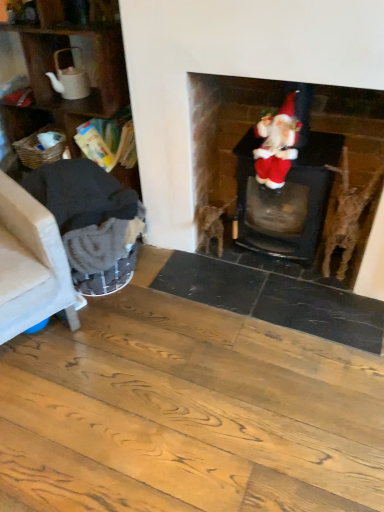
This screenshot has height=512, width=384. I want to click on wooden textured shelf at left, so click(84, 79).

Where is `dark gray fabric armchair at left, which is the first armchair from right to left`? dark gray fabric armchair at left, which is the first armchair from right to left is located at coordinates (89, 221).

The height and width of the screenshot is (512, 384). What do you see at coordinates (89, 221) in the screenshot? I see `dark gray fabric armchair at left, marked as the second armchair in a left-to-right arrangement` at bounding box center [89, 221].

In the scene shown: In order to face beige fabric armchair at left, acting as the first armchair starting from the left, should I rotate leftwards or rightwards?

It's best to rotate left around 26.788 degrees.

Where is `velvet santa at upper right`? The width and height of the screenshot is (384, 512). velvet santa at upper right is located at coordinates (224, 127).

Image resolution: width=384 pixels, height=512 pixels. Find the location of `wooden textured shelf at left`. wooden textured shelf at left is located at coordinates (84, 79).

Which is correct: velvet santa at center is inside wooden textured shelf at left, or outside of it?

velvet santa at center cannot be found inside wooden textured shelf at left.

Considering the relative positions of velvet santa at center and wooden textured shelf at left in the image provided, is velvet santa at center behind wooden textured shelf at left?

No, velvet santa at center is closer to the camera.

From the image's perspective, which one is positioned lower, velvet santa at center or wooden textured shelf at left?

velvet santa at center is shown below in the image.

Between velvet santa at center and wooden textured shelf at left, which one has less height?

Standing shorter between the two is velvet santa at center.

Is wooden textured shelf at left positioned far away from velvet santa at upper right?

wooden textured shelf at left is actually quite close to velvet santa at upper right.

From the image's perspective, which is above, wooden textured shelf at left or velvet santa at upper right?

wooden textured shelf at left is shown above in the image.

Does wooden textured shelf at left have a smaller size compared to velvet santa at upper right?

No.

Is point (60, 36) less distant than point (355, 173)?

Yes, it is in front of point (355, 173).

Is velvet santa at upper right not inside beige fabric armchair at left, acting as the first armchair starting from the left?

Yes, velvet santa at upper right is located beyond the bounds of beige fabric armchair at left, acting as the first armchair starting from the left.

From the image's perspective, relative to beige fabric armchair at left, placed as the 2th armchair when sorted from right to left, is velvet santa at upper right above or below?

Clearly, from the image's perspective, velvet santa at upper right is above beige fabric armchair at left, placed as the 2th armchair when sorted from right to left.

From a real-world perspective, does velvet santa at upper right sit lower than beige fabric armchair at left, placed as the 2th armchair when sorted from right to left?

No, from a real-world perspective, velvet santa at upper right is not under beige fabric armchair at left, placed as the 2th armchair when sorted from right to left.

Between velvet santa at upper right and beige fabric armchair at left, acting as the first armchair starting from the left, which one has smaller width?

velvet santa at upper right is thinner.

Based on the photo, is dark gray fabric armchair at left, marked as the second armchair in a left-to-right arrangement, a part of wooden textured shelf at left?

No, dark gray fabric armchair at left, marked as the second armchair in a left-to-right arrangement, is not surrounded by wooden textured shelf at left.

How many degrees apart are the facing directions of wooden textured shelf at left and dark gray fabric armchair at left, marked as the second armchair in a left-to-right arrangement?

71.5 degrees.

This screenshot has width=384, height=512. What are the coordinates of `armchair on the right of wooden textured shelf at left` in the screenshot? It's located at (89, 221).

From a real-world perspective, relative to dark gray fabric armchair at left, which is the first armchair from right to left, is wooden textured shelf at left vertically above or below?

In terms of real-world spatial position, wooden textured shelf at left is above dark gray fabric armchair at left, which is the first armchair from right to left.

Does dark gray fabric armchair at left, marked as the second armchair in a left-to-right arrangement, appear on the right side of velvet santa at center?

No, dark gray fabric armchair at left, marked as the second armchair in a left-to-right arrangement, is not to the right of velvet santa at center.

Considering the points (87, 183) and (274, 161), which point is in front, point (87, 183) or point (274, 161)?

Point (274, 161)

Consider the image. Is dark gray fabric armchair at left, marked as the second armchair in a left-to-right arrangement, oriented towards velvet santa at center?

No, dark gray fabric armchair at left, marked as the second armchair in a left-to-right arrangement, does not turn towards velvet santa at center.

Is dark gray fabric armchair at left, which is the first armchair from right to left, not inside velvet santa at center?

Yes, dark gray fabric armchair at left, which is the first armchair from right to left, is not within velvet santa at center.

Between wooden textured shelf at left and beige fabric armchair at left, placed as the 2th armchair when sorted from right to left, which one has smaller width?

wooden textured shelf at left.

Is wooden textured shelf at left looking in the opposite direction of beige fabric armchair at left, acting as the first armchair starting from the left?

wooden textured shelf at left does not have its back to beige fabric armchair at left, acting as the first armchair starting from the left.

Which is more to the right, wooden textured shelf at left or beige fabric armchair at left, acting as the first armchair starting from the left?

Positioned to the right is wooden textured shelf at left.

Are wooden textured shelf at left and beige fabric armchair at left, placed as the 2th armchair when sorted from right to left, located far from each other?

They are positioned close to each other.

Would you say beige fabric armchair at left, acting as the first armchair starting from the left, is a long distance from dark gray fabric armchair at left, marked as the second armchair in a left-to-right arrangement?

No, there isn't a large distance between beige fabric armchair at left, acting as the first armchair starting from the left, and dark gray fabric armchair at left, marked as the second armchair in a left-to-right arrangement.

In the image, is beige fabric armchair at left, acting as the first armchair starting from the left, on the left side or the right side of dark gray fabric armchair at left, which is the first armchair from right to left?

From the image, it's evident that beige fabric armchair at left, acting as the first armchair starting from the left, is to the left of dark gray fabric armchair at left, which is the first armchair from right to left.

Could you measure the distance between beige fabric armchair at left, acting as the first armchair starting from the left, and dark gray fabric armchair at left, marked as the second armchair in a left-to-right arrangement?

beige fabric armchair at left, acting as the first armchair starting from the left, and dark gray fabric armchair at left, marked as the second armchair in a left-to-right arrangement, are 7.65 inches apart.

Is beige fabric armchair at left, acting as the first armchair starting from the left, inside or outside of dark gray fabric armchair at left, which is the first armchair from right to left?

beige fabric armchair at left, acting as the first armchair starting from the left, lies outside dark gray fabric armchair at left, which is the first armchair from right to left.

The height and width of the screenshot is (512, 384). What are the coordinates of `shelf behind the velvet santa at center` in the screenshot? It's located at (84, 79).

Where is `shelf above the velvet santa at upper right (from the image's perspective)`? The image size is (384, 512). shelf above the velvet santa at upper right (from the image's perspective) is located at coordinates (84, 79).

From the image, which object appears to be farther from dark gray fabric armchair at left, marked as the second armchair in a left-to-right arrangement, beige fabric armchair at left, acting as the first armchair starting from the left, or wooden textured shelf at left?

wooden textured shelf at left.

Based on their spatial positions, is beige fabric armchair at left, acting as the first armchair starting from the left, or wooden textured shelf at left further from velvet santa at upper right?

beige fabric armchair at left, acting as the first armchair starting from the left, is further to velvet santa at upper right.

Based on their spatial positions, is dark gray fabric armchair at left, marked as the second armchair in a left-to-right arrangement, or velvet santa at upper right further from beige fabric armchair at left, placed as the 2th armchair when sorted from right to left?

velvet santa at upper right lies further to beige fabric armchair at left, placed as the 2th armchair when sorted from right to left, than the other object.

From the image, which object appears to be nearer to velvet santa at upper right, velvet santa at center or beige fabric armchair at left, placed as the 2th armchair when sorted from right to left?

velvet santa at center is positioned closer to the anchor velvet santa at upper right.

From the image, which object appears to be farther from velvet santa at center, velvet santa at upper right or dark gray fabric armchair at left, marked as the second armchair in a left-to-right arrangement?

Based on the image, dark gray fabric armchair at left, marked as the second armchair in a left-to-right arrangement, appears to be further to velvet santa at center.

Considering their positions, is beige fabric armchair at left, placed as the 2th armchair when sorted from right to left, positioned closer to velvet santa at upper right than dark gray fabric armchair at left, marked as the second armchair in a left-to-right arrangement?

dark gray fabric armchair at left, marked as the second armchair in a left-to-right arrangement, lies closer to velvet santa at upper right than the other object.

From the image, which object appears to be nearer to velvet santa at center, velvet santa at upper right or wooden textured shelf at left?

The object closer to velvet santa at center is velvet santa at upper right.

When comparing their distances from velvet santa at upper right, does velvet santa at center or dark gray fabric armchair at left, which is the first armchair from right to left, seem further?

dark gray fabric armchair at left, which is the first armchair from right to left, lies further to velvet santa at upper right than the other object.

Where is `person located between beige fabric armchair at left, placed as the 2th armchair when sorted from right to left, and velvet santa at upper right in the left-right direction`? Image resolution: width=384 pixels, height=512 pixels. person located between beige fabric armchair at left, placed as the 2th armchair when sorted from right to left, and velvet santa at upper right in the left-right direction is located at coordinates (277, 144).

Where is `armchair between beige fabric armchair at left, placed as the 2th armchair when sorted from right to left, and velvet santa at center from left to right`? The height and width of the screenshot is (512, 384). armchair between beige fabric armchair at left, placed as the 2th armchair when sorted from right to left, and velvet santa at center from left to right is located at coordinates (x=89, y=221).

Locate an element on the screen. This screenshot has height=512, width=384. shelf between beige fabric armchair at left, placed as the 2th armchair when sorted from right to left, and velvet santa at upper right, in the horizontal direction is located at coordinates (84, 79).

Where is `person between dark gray fabric armchair at left, marked as the second armchair in a left-to-right arrangement, and velvet santa at upper right`? The height and width of the screenshot is (512, 384). person between dark gray fabric armchair at left, marked as the second armchair in a left-to-right arrangement, and velvet santa at upper right is located at coordinates (277, 144).